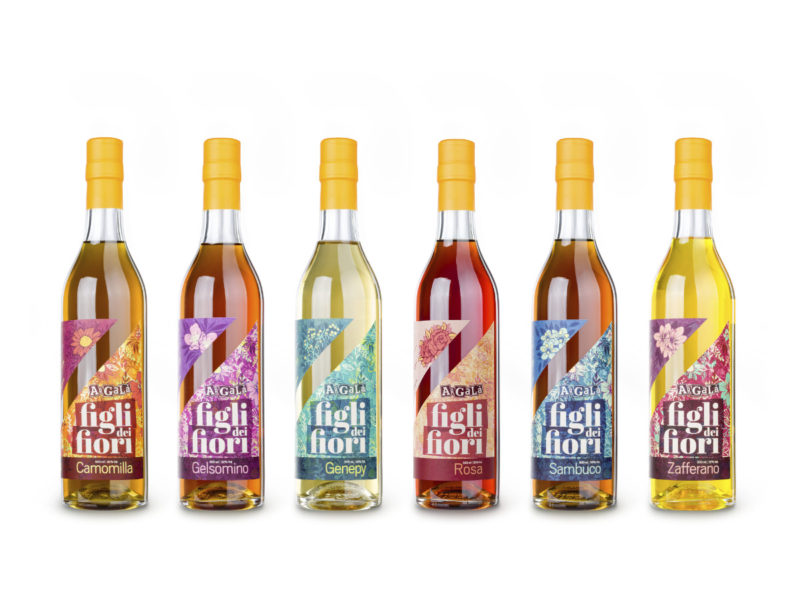
You are a GUI agent. You are given a task and a screenshot of the screen. Output one action in this format:
    pyautogui.click(x=<x>, y=<y>)
    Task: Click on the bottles
    
    Given the screenshot: What is the action you would take?
    pyautogui.click(x=117, y=309), pyautogui.click(x=429, y=273), pyautogui.click(x=690, y=324)